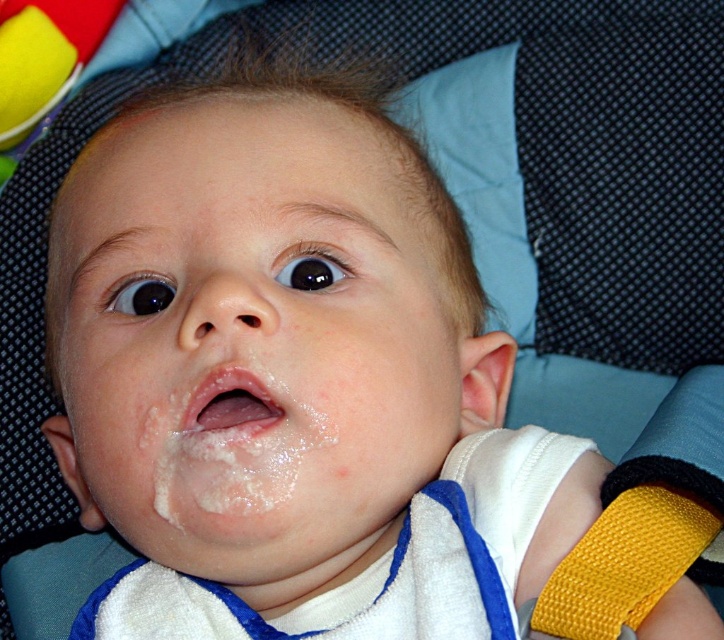
Question: Is smooth skin baby face at center positioned at the back of yellow fabric strap at lower right?

Choices:
 (A) yes
 (B) no

Answer: (A)

Question: Estimate the real-world distances between objects in this image. Which object is closer to the yellow fabric strap at lower right?

Choices:
 (A) white glossy lips at center
 (B) smooth skin baby face at center

Answer: (A)

Question: Estimate the real-world distances between objects in this image. Which object is closer to the smooth skin baby face at center?

Choices:
 (A) yellow fabric strap at lower right
 (B) white glossy lips at center

Answer: (B)

Question: Which of the following is the farthest from the observer?

Choices:
 (A) (607, 625)
 (B) (219, 384)

Answer: (B)

Question: Does smooth skin baby face at center appear over white glossy lips at center?

Choices:
 (A) no
 (B) yes

Answer: (B)

Question: Is smooth skin baby face at center smaller than white glossy lips at center?

Choices:
 (A) yes
 (B) no

Answer: (B)